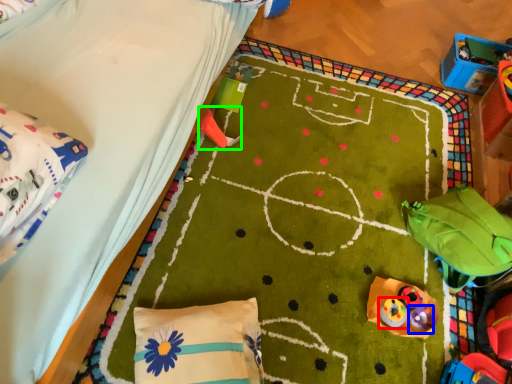
Question: Estimate the real-world distances between objects in this image. Which object is farther from toy (highlighted by a red box), toy (highlighted by a blue box) or toy (highlighted by a green box)?

Choices:
 (A) toy
 (B) toy

Answer: (B)